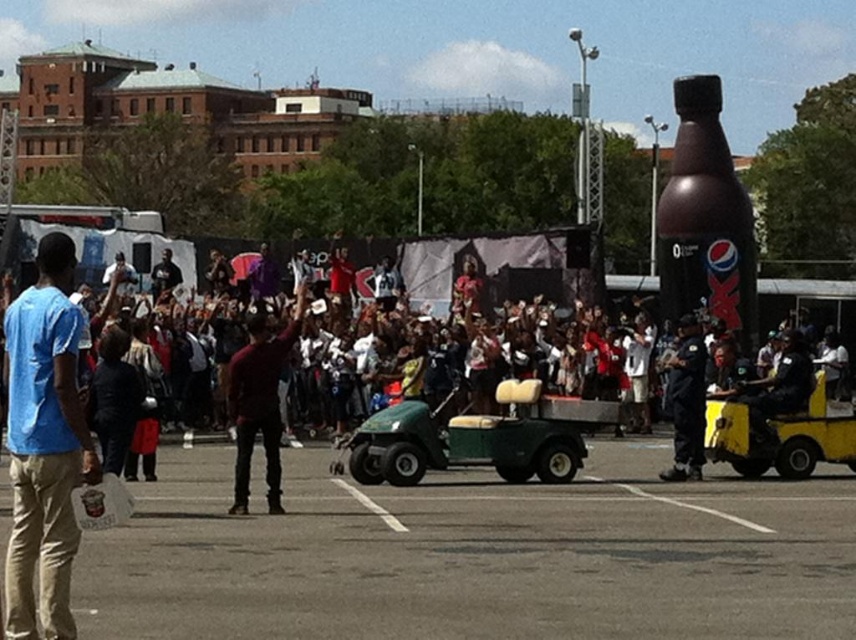
Question: Is green rubber golf cart at center behind maroon fabric shirt at center?

Choices:
 (A) yes
 (B) no

Answer: (A)

Question: Can you confirm if gray asphalt parking lot at lower center is positioned above yellow plastic cart at right?

Choices:
 (A) no
 (B) yes

Answer: (A)

Question: Is yellow plastic cart at right positioned behind black uniformed officer at center?

Choices:
 (A) no
 (B) yes

Answer: (B)

Question: Among these points, which one is nearest to the camera?

Choices:
 (A) (254, 387)
 (B) (758, 470)
 (C) (572, 506)

Answer: (A)

Question: Which object is positioned closest to the blue cotton shirt at left?

Choices:
 (A) gray asphalt parking lot at lower center
 (B) yellow plastic cart at right

Answer: (A)

Question: Considering the real-world distances, which object is farthest from the blue cotton shirt at left?

Choices:
 (A) green rubber golf cart at center
 (B) yellow plastic cart at right

Answer: (B)